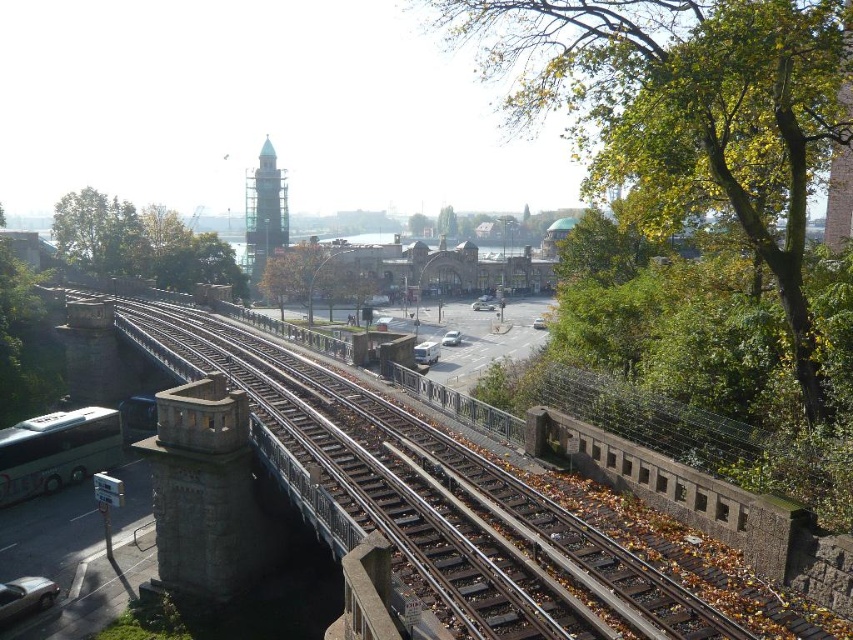
Based on the photo, you are standing at the camera position and want to reach the point marked as point (9, 589). If you walk straight ahead, will you reach that point without turning?

Yes, because the point (9, 589) is directly ahead in your line of sight from the camera position, so walking straight will lead you there.

You are an architect reviewing a blueprint of the railway bridge and need to determine the order of construction for two key points. The points are labeled as point 1 at coordinates point (347, 298) and point 2 at coordinates point (428, 362). Based on their positions in the image, which point should be constructed first if the construction starts from the nearest point to the viewer?

Point 1 at coordinates point (347, 298) should be constructed first because it is closer to the viewer compared to point 2 at coordinates point (428, 362).